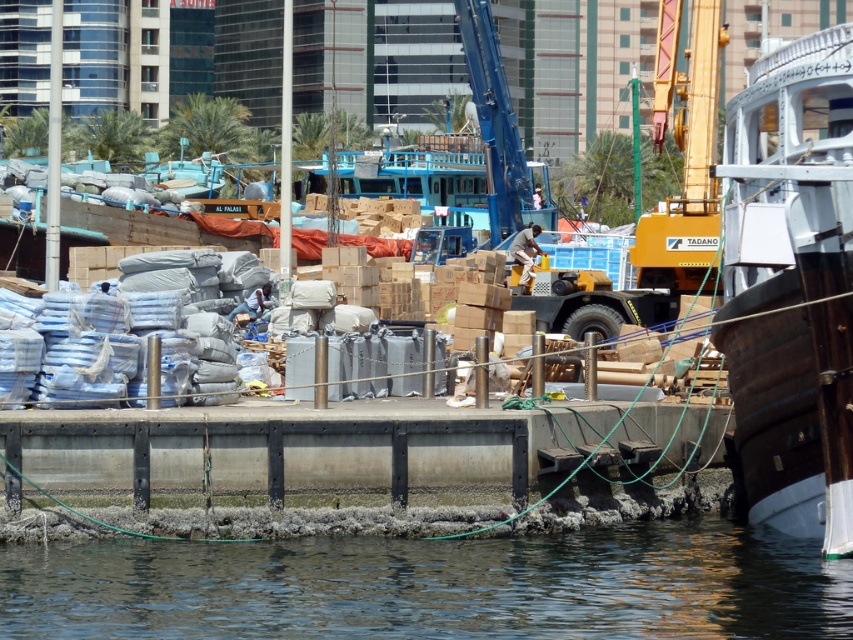
You are standing at the dock and want to reach the point marked as point (343, 576). Given that the dock is 25 meters long, can you safely walk to that point without exceeding the dock length?

The point (343, 576) is 24.46 meters from the viewer, which is within the 25 meter length of the dock. Therefore, you can safely walk to that point without exceeding the dock length.

You are a dock worker who needs to secure a new shipment. You have a heavy crate that needs to be placed on the wooden boat at right. However, you notice the clear water at lower center nearby. Where should you place the crate to avoid it falling into the water?

Place the crate on the wooden boat at right away from the clear water at lower center since the water is to the left of the boat, so placing it on the right side of the boat would keep it away from the water.